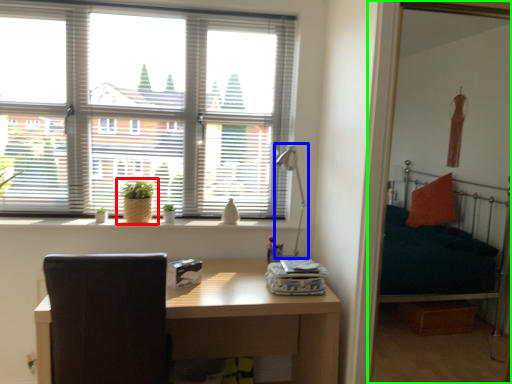
Question: Which object is positioned farthest from houseplant (highlighted by a red box)? Select from table lamp (highlighted by a blue box) and bunk bed (highlighted by a green box).

Choices:
 (A) table lamp
 (B) bunk bed

Answer: (B)